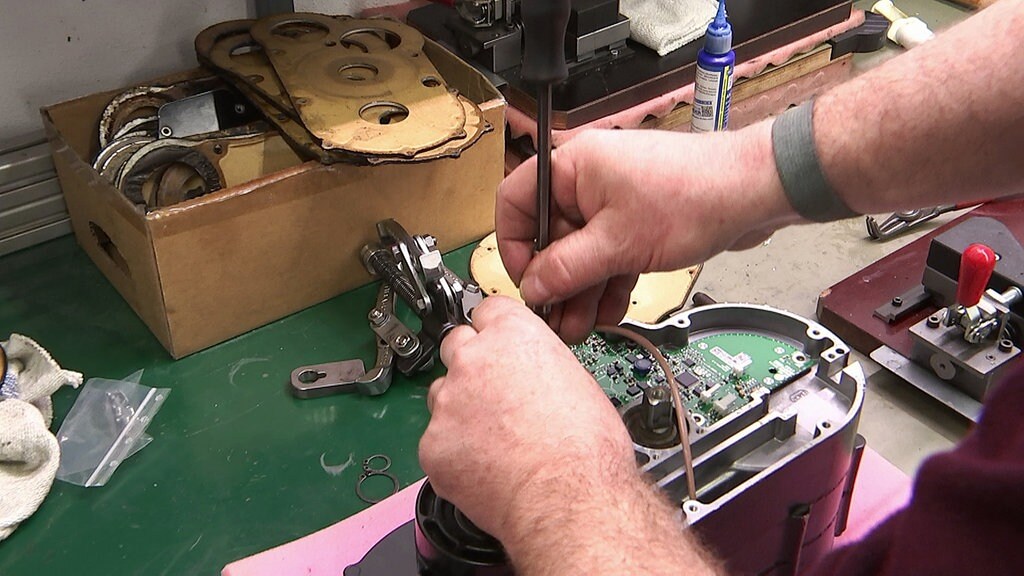
Where is `wall`? The height and width of the screenshot is (576, 1024). wall is located at coordinates (47, 24).